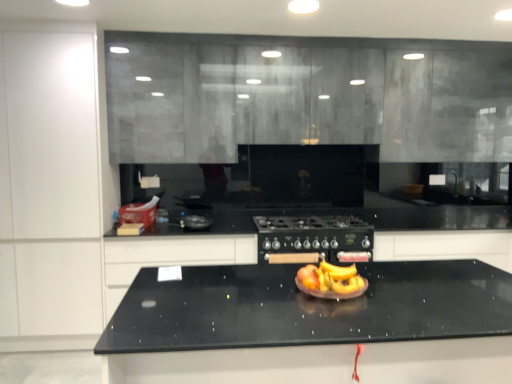
Locate an element on the screen. This screenshot has width=512, height=384. black granite countertop at center is located at coordinates (308, 307).

The image size is (512, 384). What do you see at coordinates (314, 239) in the screenshot?
I see `black matte gas stove at center` at bounding box center [314, 239].

The image size is (512, 384). What do you see at coordinates (446, 246) in the screenshot?
I see `black matte cabinet at center, the fourth cabinetry positioned from the left` at bounding box center [446, 246].

Identify the location of white matte cabinet at left, the fourth cabinetry viewed from the right. (50, 188).

Where is `black granite countertop at center`? The image size is (512, 384). black granite countertop at center is located at coordinates (308, 307).

In terms of width, does black granite countertop at center look wider or thinner when compared to white matte cabinet at left, the fourth cabinetry viewed from the right?

Considering their sizes, black granite countertop at center looks broader than white matte cabinet at left, the fourth cabinetry viewed from the right.

Who is more distant, black granite countertop at center or white matte cabinet at left, which ranks as the 1th cabinetry in left-to-right order?

white matte cabinet at left, which ranks as the 1th cabinetry in left-to-right order, is further away from the camera.

Considering the relative positions of black granite countertop at center and white matte cabinet at left, the fourth cabinetry viewed from the right, in the image provided, is black granite countertop at center to the left of white matte cabinet at left, the fourth cabinetry viewed from the right, from the viewer's perspective?

No.

Is white matte cabinet at left, which ranks as the 1th cabinetry in left-to-right order, inside black granite countertop at center?

No, white matte cabinet at left, which ranks as the 1th cabinetry in left-to-right order, is located outside of black granite countertop at center.

Between black granite countertop at center and black granite countertop at center, which is counted as the third cabinetry, starting from the right, which one appears on the right side from the viewer's perspective?

From the viewer's perspective, black granite countertop at center appears more on the right side.

Does black granite countertop at center have a greater height compared to black granite countertop at center, which is the 2th cabinetry from left to right?

Correct, black granite countertop at center is much taller as black granite countertop at center, which is the 2th cabinetry from left to right.

Is the position of black granite countertop at center more distant than that of black granite countertop at center, which is counted as the third cabinetry, starting from the right?

That is False.

Based on the photo, does shiny plastic fruit bowl at center have a lesser width compared to black granite countertop at center, which is counted as the third cabinetry, starting from the right?

Yes, shiny plastic fruit bowl at center is thinner than black granite countertop at center, which is counted as the third cabinetry, starting from the right.

From the image's perspective, which object appears higher, shiny plastic fruit bowl at center or black granite countertop at center, which is counted as the third cabinetry, starting from the right?

From the image's view, shiny plastic fruit bowl at center is above.

Is shiny plastic fruit bowl at center oriented away from black granite countertop at center, which is the 2th cabinetry from left to right?

No, shiny plastic fruit bowl at center is not facing the opposite direction of black granite countertop at center, which is the 2th cabinetry from left to right.

Does point (325, 280) lie in front of point (106, 302)?

Yes, it is.

Who is smaller, shiny plastic fruit bowl at center or black granite countertop at center?

shiny plastic fruit bowl at center.

Does point (333, 269) lie behind point (203, 287)?

That is True.

Looking at this image, considering the relative sizes of shiny plastic fruit bowl at center and black granite countertop at center in the image provided, is shiny plastic fruit bowl at center thinner than black granite countertop at center?

Yes, shiny plastic fruit bowl at center is thinner than black granite countertop at center.

Can you tell me how much shiny plastic fruit bowl at center and black granite countertop at center differ in facing direction?

The angle between the facing direction of shiny plastic fruit bowl at center and the facing direction of black granite countertop at center is 3.02 degrees.

At what (x,y) coordinates should I click in order to perform the action: click on fruit dish that appears above the black matte cabinet at center, the first cabinetry in the right-to-left sequence (from the image's perspective). Please return your answer as a coordinate pair (x, y). The image size is (512, 384). Looking at the image, I should click on (331, 278).

Can you confirm if black matte cabinet at center, the fourth cabinetry positioned from the left, is bigger than shiny plastic fruit bowl at center?

Indeed, black matte cabinet at center, the fourth cabinetry positioned from the left, has a larger size compared to shiny plastic fruit bowl at center.

Which is in front, point (467, 254) or point (353, 288)?

The point (353, 288) is more forward.

From a real-world perspective, is black matte cabinet at center, the fourth cabinetry positioned from the left, above or below shiny plastic fruit bowl at center?

black matte cabinet at center, the fourth cabinetry positioned from the left, is below shiny plastic fruit bowl at center.

Does black granite countertop at center contain shiny plastic fruit bowl at center?

No, shiny plastic fruit bowl at center is not surrounded by black granite countertop at center.

How many degrees apart are the facing directions of black granite countertop at center and shiny plastic fruit bowl at center?

The angular difference between black granite countertop at center and shiny plastic fruit bowl at center is 3.02 degrees.

Are black granite countertop at center and shiny plastic fruit bowl at center beside each other?

black granite countertop at center is not next to shiny plastic fruit bowl at center, and they're not touching.

Looking at this image, is black granite countertop at center wider or thinner than shiny plastic fruit bowl at center?

In the image, black granite countertop at center appears to be wider than shiny plastic fruit bowl at center.

Is shiny plastic fruit bowl at center oriented away from black matte cabinet at center, the first cabinetry in the right-to-left sequence?

No.

Considering the sizes of objects shiny plastic fruit bowl at center and black matte cabinet at center, the fourth cabinetry positioned from the left, in the image provided, who is bigger, shiny plastic fruit bowl at center or black matte cabinet at center, the fourth cabinetry positioned from the left,?

Bigger between the two is black matte cabinet at center, the fourth cabinetry positioned from the left.

Is shiny plastic fruit bowl at center next to black matte cabinet at center, the fourth cabinetry positioned from the left?

shiny plastic fruit bowl at center is not next to black matte cabinet at center, the fourth cabinetry positioned from the left, and they're not touching.

How different are the orientations of shiny plastic fruit bowl at center and black matte cabinet at center, the first cabinetry in the right-to-left sequence, in degrees?

shiny plastic fruit bowl at center and black matte cabinet at center, the first cabinetry in the right-to-left sequence, are facing 3.29 degrees away from each other.

Where is `countertop in front of the white matte cabinet at left, the fourth cabinetry viewed from the right`? Image resolution: width=512 pixels, height=384 pixels. countertop in front of the white matte cabinet at left, the fourth cabinetry viewed from the right is located at coordinates (308, 307).

Locate an element on the screen. countertop below the black granite countertop at center, which is the 2th cabinetry from left to right (from a real-world perspective) is located at coordinates (308, 307).

Which object lies nearer to the anchor point white matte cabinet at left, the fourth cabinetry viewed from the right, black granite countertop at center or shiny plastic fruit bowl at center?

Based on the image, black granite countertop at center appears to be nearer to white matte cabinet at left, the fourth cabinetry viewed from the right.

From the image, which object appears to be nearer to matte gray cabinetry at upper center, marked as the 3th cabinetry in a left-to-right arrangement, black matte cabinet at center, the fourth cabinetry positioned from the left, or black matte gas stove at center?

The object closer to matte gray cabinetry at upper center, marked as the 3th cabinetry in a left-to-right arrangement, is black matte gas stove at center.

Estimate the real-world distances between objects in this image. Which object is further from white matte cabinet at left, which ranks as the 1th cabinetry in left-to-right order, shiny plastic fruit bowl at center or black matte gas stove at center?

shiny plastic fruit bowl at center lies further to white matte cabinet at left, which ranks as the 1th cabinetry in left-to-right order, than the other object.

Estimate the real-world distances between objects in this image. Which object is closer to black matte gas stove at center, matte gray cabinetry at upper center, the 2th cabinetry from the right, or black matte cabinet at center, the fourth cabinetry positioned from the left?

Among the two, black matte cabinet at center, the fourth cabinetry positioned from the left, is located nearer to black matte gas stove at center.

Based on their spatial positions, is black granite countertop at center, which is counted as the third cabinetry, starting from the right, or black matte cabinet at center, the fourth cabinetry positioned from the left, closer to black granite countertop at center?

The object closer to black granite countertop at center is black granite countertop at center, which is counted as the third cabinetry, starting from the right.

Based on their spatial positions, is white matte cabinet at left, the fourth cabinetry viewed from the right, or matte gray cabinetry at upper center, marked as the 3th cabinetry in a left-to-right arrangement, further from black matte gas stove at center?

The object further to black matte gas stove at center is white matte cabinet at left, the fourth cabinetry viewed from the right.

Based on their spatial positions, is matte gray cabinetry at upper center, the 2th cabinetry from the right, or shiny plastic fruit bowl at center further from white matte cabinet at left, which ranks as the 1th cabinetry in left-to-right order?

shiny plastic fruit bowl at center is further to white matte cabinet at left, which ranks as the 1th cabinetry in left-to-right order.

Estimate the real-world distances between objects in this image. Which object is further from black matte cabinet at center, the first cabinetry in the right-to-left sequence, black matte gas stove at center or black granite countertop at center?

Among the two, black granite countertop at center is located further to black matte cabinet at center, the first cabinetry in the right-to-left sequence.

The width and height of the screenshot is (512, 384). I want to click on home appliance between matte gray cabinetry at upper center, the 2th cabinetry from the right, and black granite countertop at center, which is the 2th cabinetry from left to right, vertically, so click(314, 239).

Identify the location of home appliance situated between white matte cabinet at left, which ranks as the 1th cabinetry in left-to-right order, and black matte cabinet at center, the fourth cabinetry positioned from the left, from left to right. This screenshot has width=512, height=384. (314, 239).

This screenshot has width=512, height=384. Identify the location of home appliance between shiny plastic fruit bowl at center and black matte cabinet at center, the first cabinetry in the right-to-left sequence, in the front-back direction. (314, 239).

You are a GUI agent. You are given a task and a screenshot of the screen. Output one action in this format:
    pyautogui.click(x=<x>, y=<y>)
    Task: Click on the cabinetry between white matte cabinet at left, which ranks as the 1th cabinetry in left-to-right order, and shiny plastic fruit bowl at center, in the horizontal direction
    
    Given the screenshot: What is the action you would take?
    pyautogui.click(x=168, y=257)